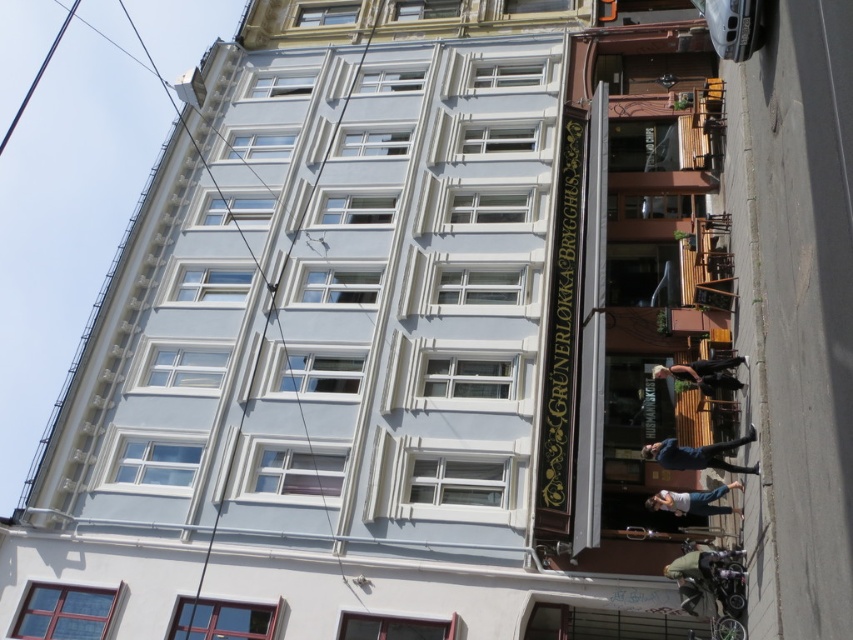
You are a fashion designer observing a person wearing a green fabric jacket at lower right and light blue jeans at lower center. Which clothing item is narrower?

The green fabric jacket at lower right has a lesser width compared to the light blue jeans at lower center, so the green fabric jacket at lower right is narrower.

Looking at this image, you are a delivery person standing in front of the building and see a blue denim jacket at lower center and a light blue jeans at lower center. Which item is bigger?

The blue denim jacket at lower center is larger in size compared to the light blue jeans at lower center.